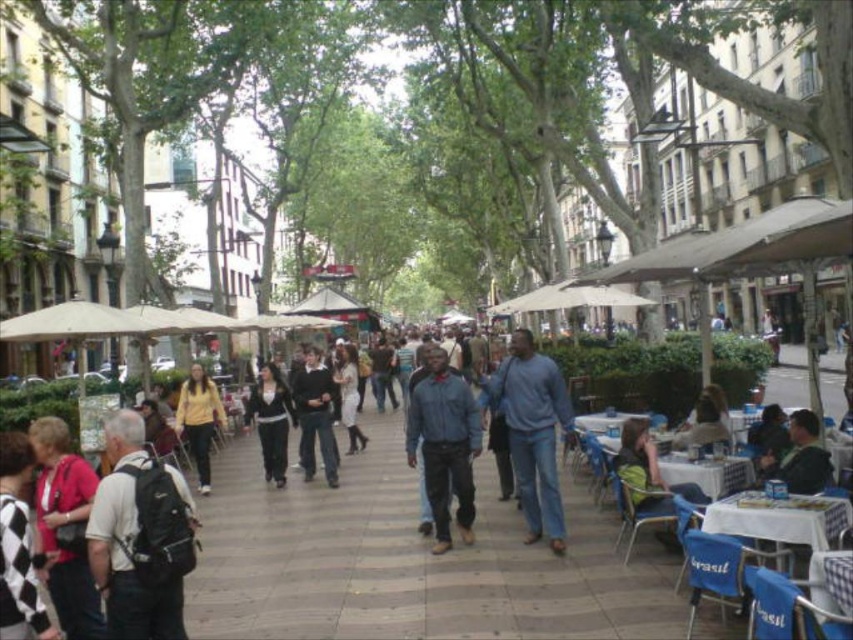
Does black fabric backpack at left have a lesser width compared to light brown leather jacket at lower right?

In fact, black fabric backpack at left might be wider than light brown leather jacket at lower right.

From the picture: Does black fabric backpack at left come in front of light brown leather jacket at lower right?

Yes, black fabric backpack at left is in front of light brown leather jacket at lower right.

You are a GUI agent. You are given a task and a screenshot of the screen. Output one action in this format:
    pyautogui.click(x=<x>, y=<y>)
    Task: Click on the black fabric backpack at left
    The height and width of the screenshot is (640, 853).
    Given the screenshot: What is the action you would take?
    pyautogui.click(x=140, y=536)

Based on the photo, between green fabric shirt at lower right and dark blue sweater at center, which one appears on the left side from the viewer's perspective?

dark blue sweater at center

Who is taller, green fabric shirt at lower right or dark blue sweater at center?

dark blue sweater at center

Which is in front, point (697, 484) or point (318, 371)?

Point (697, 484) is in front.

Find the location of a particular element. This screenshot has height=640, width=853. green fabric shirt at lower right is located at coordinates (647, 472).

Can you confirm if dark blue sweater at center is shorter than black matte pants at center?

In fact, dark blue sweater at center may be taller than black matte pants at center.

Looking at this image, which is more to the left, dark blue sweater at center or black matte pants at center?

black matte pants at center

Does point (302, 408) come closer to viewer compared to point (257, 433)?

That is True.

Find the location of a particular element. This screenshot has width=853, height=640. dark blue sweater at center is located at coordinates [x=315, y=417].